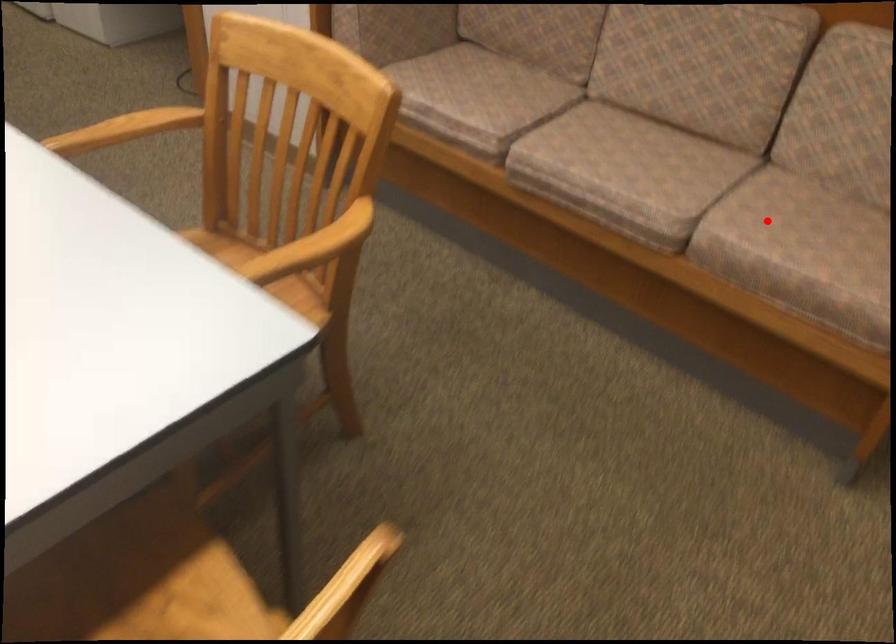
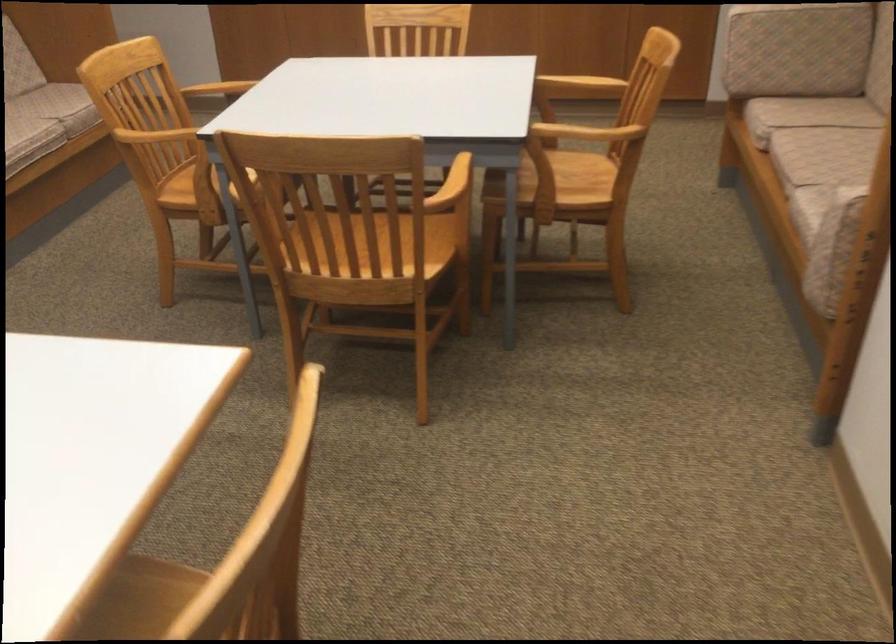
Question: I am providing you with two images of the same scene from different viewpoints. In image1, a red point is highlighted. Considering the same 3D point in image2, which of the following is correct?

Choices:
 (A) It is closer
 (B) It is farther

Answer: (B)